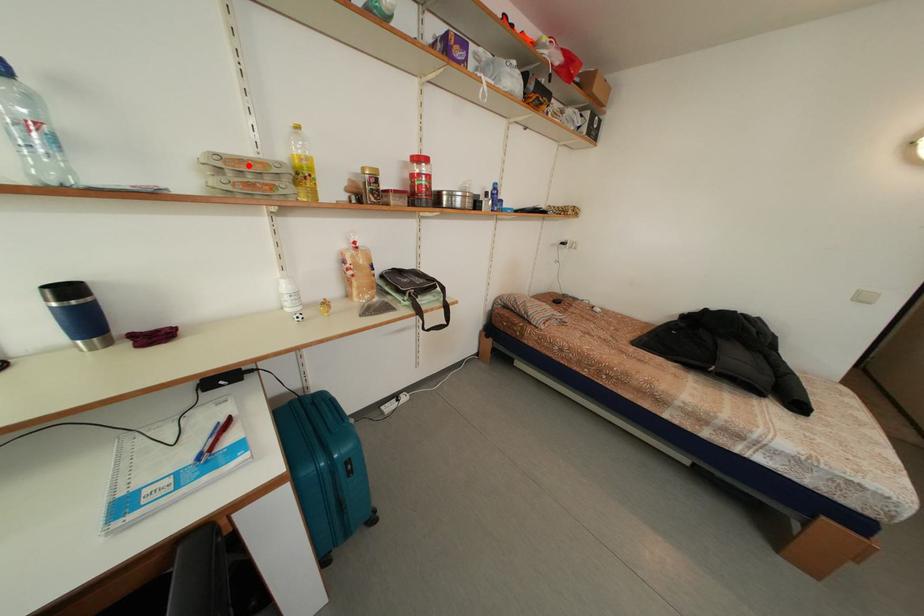
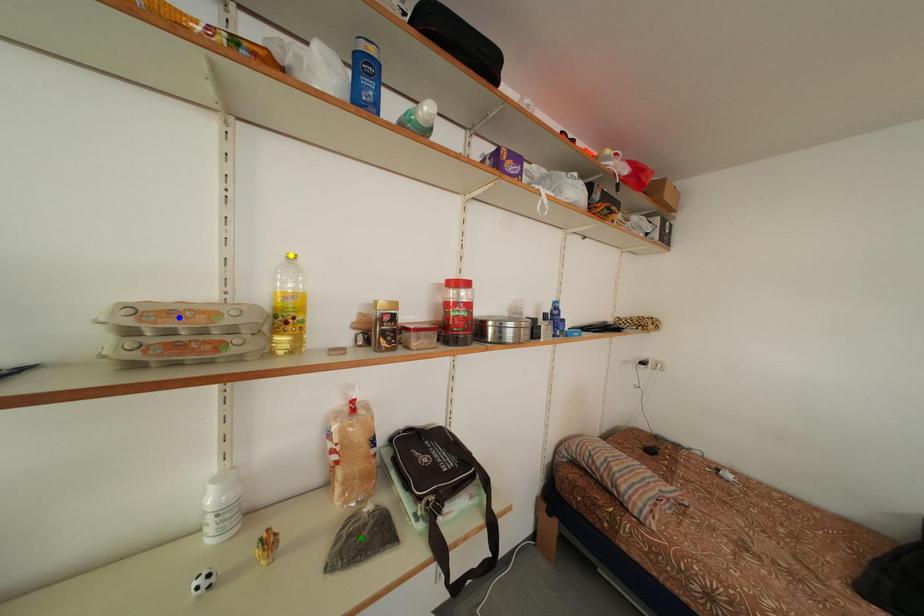
Question: I am providing you with two images of the same scene from different viewpoints. A red point is marked on the first image. You are given multiple points on the second image. Which point in image 2 represents the same 3d spot as the red point in image 1?

Choices:
 (A) green point
 (B) blue point
 (C) yellow point

Answer: (B)